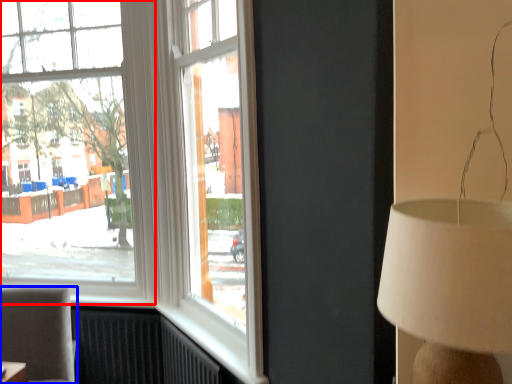
Question: Which object appears closest to the camera in this image, window (highlighted by a red box) or furniture (highlighted by a blue box)?

Choices:
 (A) window
 (B) furniture

Answer: (B)